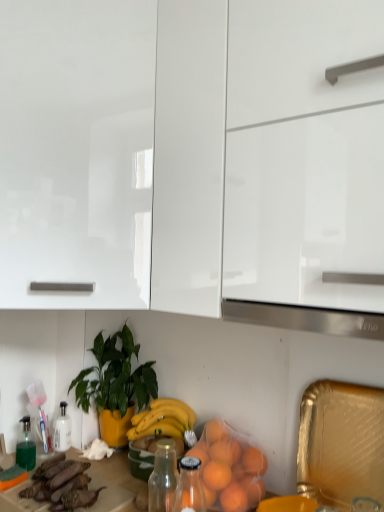
What is the approximate width of glossy white cabinet at upper left, the 2th cabinetry in the right-to-left sequence?

The width of glossy white cabinet at upper left, the 2th cabinetry in the right-to-left sequence, is 20.61 inches.

The image size is (384, 512). What do you see at coordinates (76, 151) in the screenshot?
I see `glossy white cabinet at upper left, which is the 1th cabinetry from left to right` at bounding box center [76, 151].

Locate an element on the screen. The image size is (384, 512). purple matte eggplant at lower left is located at coordinates (64, 486).

What do you see at coordinates (26, 447) in the screenshot?
I see `green translucent bottle at lower left` at bounding box center [26, 447].

Locate an element on the screen. This screenshot has height=512, width=384. green glossy plant at center is located at coordinates (115, 385).

What do you see at coordinates (115, 385) in the screenshot? I see `green glossy plant at center` at bounding box center [115, 385].

What do you see at coordinates (196, 159) in the screenshot? This screenshot has height=512, width=384. I see `glossy white cabinet at upper center, placed as the 1th cabinetry when sorted from right to left` at bounding box center [196, 159].

Identify the location of glossy white cabinet at upper left, which is the 1th cabinetry from left to right. The height and width of the screenshot is (512, 384). (76, 151).

Is green glossy plant at center at the left side of satin silver exhaust hood at center?

Indeed, green glossy plant at center is positioned on the left side of satin silver exhaust hood at center.

In terms of width, does green glossy plant at center look wider or thinner when compared to satin silver exhaust hood at center?

Considering their sizes, green glossy plant at center looks slimmer than satin silver exhaust hood at center.

From a real-world perspective, who is located higher, green glossy plant at center or satin silver exhaust hood at center?

From a 3D spatial view, satin silver exhaust hood at center is above.

What's the angular difference between green glossy plant at center and satin silver exhaust hood at center's facing directions?

0.846 degrees separate the facing orientations of green glossy plant at center and satin silver exhaust hood at center.

Is point (32, 497) closer or farther from the camera than point (31, 440)?

Point (32, 497).

Measure the distance between purple matte eggplant at lower left and green translucent bottle at lower left.

purple matte eggplant at lower left is 24.75 centimeters away from green translucent bottle at lower left.

Considering the relative sizes of purple matte eggplant at lower left and green translucent bottle at lower left in the image provided, is purple matte eggplant at lower left smaller than green translucent bottle at lower left?

No.

At what (x,y) coordinates should I click in order to perform the action: click on bottle on the left of purple matte eggplant at lower left. Please return your answer as a coordinate pair (x, y). The image size is (384, 512). Looking at the image, I should click on (26, 447).

Which object is thinner, green glossy plant at center or green translucent bottle at lower left?

Thinner between the two is green translucent bottle at lower left.

Is green glossy plant at center looking in the opposite direction of green translucent bottle at lower left?

No, green glossy plant at center's orientation is not away from green translucent bottle at lower left.

Considering the positions of objects green glossy plant at center and green translucent bottle at lower left in the image provided, who is more to the right, green glossy plant at center or green translucent bottle at lower left?

Positioned to the right is green glossy plant at center.

How different are the orientations of green glossy plant at center and green translucent bottle at lower left in degrees?

green glossy plant at center and green translucent bottle at lower left are facing 89.2 degrees away from each other.

Considering the sizes of satin silver exhaust hood at center and glossy white cabinet at upper center, placed as the 1th cabinetry when sorted from right to left, in the image, is satin silver exhaust hood at center bigger or smaller than glossy white cabinet at upper center, placed as the 1th cabinetry when sorted from right to left,?

satin silver exhaust hood at center is smaller than glossy white cabinet at upper center, placed as the 1th cabinetry when sorted from right to left.

From a real-world perspective, does satin silver exhaust hood at center sit lower than glossy white cabinet at upper center, acting as the 2th cabinetry starting from the left?

Yes.

Do you think satin silver exhaust hood at center is within glossy white cabinet at upper center, acting as the 2th cabinetry starting from the left, or outside of it?

Result: satin silver exhaust hood at center fits inside glossy white cabinet at upper center, acting as the 2th cabinetry starting from the left.

Which object is wider, orange matte plastic bag at lower center or satin silver exhaust hood at center?

With larger width is satin silver exhaust hood at center.

Which of these two, orange matte plastic bag at lower center or satin silver exhaust hood at center, is smaller?

With smaller size is satin silver exhaust hood at center.

Is orange matte plastic bag at lower center aimed at satin silver exhaust hood at center?

No, orange matte plastic bag at lower center is not facing towards satin silver exhaust hood at center.

Is the surface of orange matte plastic bag at lower center in direct contact with satin silver exhaust hood at center?

No, orange matte plastic bag at lower center is not making contact with satin silver exhaust hood at center.

Is satin silver exhaust hood at center directly adjacent to green glossy plant at center?

No.

Is satin silver exhaust hood at center positioned beyond the bounds of green glossy plant at center?

Yes, satin silver exhaust hood at center is located beyond the bounds of green glossy plant at center.

Which of these two, satin silver exhaust hood at center or green glossy plant at center, is wider?

satin silver exhaust hood at center is wider.

Consider the image. From the image's perspective, which one is positioned higher, satin silver exhaust hood at center or green glossy plant at center?

satin silver exhaust hood at center.

How far apart are green translucent bottle at lower left and orange matte plastic bag at lower center?

A distance of 63.21 centimeters exists between green translucent bottle at lower left and orange matte plastic bag at lower center.

From a real-world perspective, which is physically below, green translucent bottle at lower left or orange matte plastic bag at lower center?

From a 3D spatial view, green translucent bottle at lower left is below.

Can you confirm if green translucent bottle at lower left is positioned to the left of orange matte plastic bag at lower center?

Yes, green translucent bottle at lower left is to the left of orange matte plastic bag at lower center.

Is orange matte plastic bag at lower center located within green translucent bottle at lower left?

Definitely not — orange matte plastic bag at lower center is not inside green translucent bottle at lower left.

The width and height of the screenshot is (384, 512). Identify the location of houseplant on the left of satin silver exhaust hood at center. (115, 385).

In the image, there is a green translucent bottle at lower left. What are the coordinates of `food below it (from a real-world perspective)` in the screenshot? It's located at (64, 486).

When comparing their distances from satin silver exhaust hood at center, does green glossy plant at center or orange matte plastic bag at lower center seem closer?

Based on the image, orange matte plastic bag at lower center appears to be nearer to satin silver exhaust hood at center.

Considering their positions, is green translucent bottle at lower left positioned further to orange matte plastic bag at lower center than glossy white cabinet at upper left, which is the 1th cabinetry from left to right?

glossy white cabinet at upper left, which is the 1th cabinetry from left to right, is positioned further to the anchor orange matte plastic bag at lower center.

Which object lies further to the anchor point satin silver exhaust hood at center, glossy white cabinet at upper center, placed as the 1th cabinetry when sorted from right to left, or purple matte eggplant at lower left?

purple matte eggplant at lower left is further to satin silver exhaust hood at center.

Based on their spatial positions, is orange matte plastic bag at lower center or glossy white cabinet at upper left, which is the 1th cabinetry from left to right, closer to green translucent bottle at lower left?

orange matte plastic bag at lower center is closer to green translucent bottle at lower left.

Which object lies further to the anchor point orange matte plastic bag at lower center, satin silver exhaust hood at center or green glossy plant at center?

Among the two, satin silver exhaust hood at center is located further to orange matte plastic bag at lower center.

When comparing their distances from satin silver exhaust hood at center, does green translucent bottle at lower left or green glossy plant at center seem further?

green translucent bottle at lower left is positioned further to the anchor satin silver exhaust hood at center.

Estimate the real-world distances between objects in this image. Which object is closer to green glossy plant at center, orange matte plastic bag at lower center or glossy white cabinet at upper left, the 2th cabinetry in the right-to-left sequence?

The object closer to green glossy plant at center is orange matte plastic bag at lower center.

In the scene shown: Considering their positions, is satin silver exhaust hood at center positioned further to green glossy plant at center than glossy white cabinet at upper center, acting as the 2th cabinetry starting from the left?

glossy white cabinet at upper center, acting as the 2th cabinetry starting from the left, is further to green glossy plant at center.

This screenshot has width=384, height=512. I want to click on cabinetry between glossy white cabinet at upper left, which is the 1th cabinetry from left to right, and orange matte plastic bag at lower center vertically, so click(196, 159).

Identify the location of cabinetry located between glossy white cabinet at upper left, which is the 1th cabinetry from left to right, and satin silver exhaust hood at center in the left-right direction. (196, 159).

Where is `houseplant located between purple matte eggplant at lower left and green translucent bottle at lower left in the depth direction`? This screenshot has height=512, width=384. houseplant located between purple matte eggplant at lower left and green translucent bottle at lower left in the depth direction is located at coordinates (115, 385).

Locate an element on the screen. houseplant between glossy white cabinet at upper left, the 2th cabinetry in the right-to-left sequence, and orange matte plastic bag at lower center, in the vertical direction is located at coordinates (115, 385).